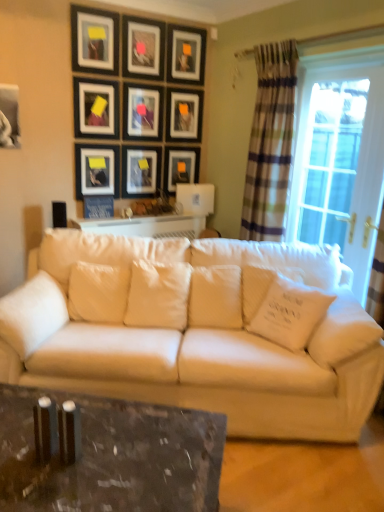
Describe the element at coordinates (196, 339) in the screenshot. The height and width of the screenshot is (512, 384). I see `white fabric couch at center` at that location.

Describe the element at coordinates (184, 115) in the screenshot. I see `matte black picture frame at upper center, the 4th picture frame from the top` at that location.

Image resolution: width=384 pixels, height=512 pixels. What do you see at coordinates (98, 292) in the screenshot? I see `white fabric pillow at center, which is the second pillow from left to right` at bounding box center [98, 292].

Image resolution: width=384 pixels, height=512 pixels. What do you see at coordinates (96, 108) in the screenshot? I see `matte black picture frame at upper center, which is counted as the 5th picture frame, starting from the bottom` at bounding box center [96, 108].

Locate an element on the screen. This screenshot has height=512, width=384. plaid fabric curtain at right is located at coordinates (270, 143).

Measure the distance between point [133,46] and camera.

10.66 feet.

Locate an element on the screen. white fabric couch at center is located at coordinates (196, 339).

Could you tell me if matte black picture frame at upper left, which is counted as the 9th picture frame, starting from the top, is turned towards white soft pillow at left, the first pillow positioned from the left?

No, matte black picture frame at upper left, which is counted as the 9th picture frame, starting from the top, does not turn towards white soft pillow at left, the first pillow positioned from the left.

Is the surface of matte black picture frame at upper left, which is counted as the 9th picture frame, starting from the top, in direct contact with white soft pillow at left, the first pillow positioned from the left?

matte black picture frame at upper left, which is counted as the 9th picture frame, starting from the top, and white soft pillow at left, the first pillow positioned from the left, are clearly separated.

Which point is more distant from viewer, (97,170) or (55,303)?

The point (97,170) is farther from the camera.

Considering the positions of objects white fabric couch at center and white soft pillow at left, which is the fifth pillow from right to left, in the image provided, who is behind, white fabric couch at center or white soft pillow at left, which is the fifth pillow from right to left,?

Positioned behind is white soft pillow at left, which is the fifth pillow from right to left.

Is white fabric couch at center wider than white soft pillow at left, which is the fifth pillow from right to left?

Correct, the width of white fabric couch at center exceeds that of white soft pillow at left, which is the fifth pillow from right to left.

Which of these two, white fabric couch at center or white soft pillow at left, the first pillow positioned from the left, is smaller?

Smaller between the two is white soft pillow at left, the first pillow positioned from the left.

Is white fabric couch at center not near white soft pillow at left, the first pillow positioned from the left?

No, white fabric couch at center is in close proximity to white soft pillow at left, the first pillow positioned from the left.

Based on their positions, is matte black picture frame at center, marked as the 6th picture frame in a bottom-to-top arrangement, located to the left or right of clear glass window at right?

Clearly, matte black picture frame at center, marked as the 6th picture frame in a bottom-to-top arrangement, is on the left of clear glass window at right in the image.

From a real-world perspective, which object rests below the other?

clear glass window at right, from a real-world perspective.

Can you see matte black picture frame at center, marked as the 6th picture frame in a bottom-to-top arrangement, touching clear glass window at right?

No, matte black picture frame at center, marked as the 6th picture frame in a bottom-to-top arrangement, is not making contact with clear glass window at right.

Is matte black picture frame at center, marked as the 6th picture frame in a bottom-to-top arrangement, looking in the opposite direction of clear glass window at right?

matte black picture frame at center, marked as the 6th picture frame in a bottom-to-top arrangement, is not turned away from clear glass window at right.

Considering the positions of point (23, 328) and point (95, 70), is point (23, 328) closer or farther from the camera than point (95, 70)?

Point (23, 328) appears to be closer to the viewer than point (95, 70).

How different are the orientations of white soft pillow at left, the first pillow positioned from the left, and matte black picture frame at upper left, the 8th picture frame from the bottom, in degrees?

white soft pillow at left, the first pillow positioned from the left, and matte black picture frame at upper left, the 8th picture frame from the bottom, are facing 53.5 degrees away from each other.

From the picture: Is white soft pillow at left, which is the fifth pillow from right to left, next to matte black picture frame at upper left, which is the third picture frame from top to bottom?

No, white soft pillow at left, which is the fifth pillow from right to left, is not making contact with matte black picture frame at upper left, which is the third picture frame from top to bottom.

From a real-world perspective, is white soft pillow at left, which is the fifth pillow from right to left, located higher than matte black picture frame at upper left, which is the third picture frame from top to bottom?

No, from a real-world perspective, white soft pillow at left, which is the fifth pillow from right to left, is not above matte black picture frame at upper left, which is the third picture frame from top to bottom.

Are white quilted pillow at center, marked as the 4th pillow in a left-to-right arrangement, and matte black picture frame at upper left, the 8th picture frame from the bottom, located far from each other?

Yes.

Is white quilted pillow at center, marked as the 4th pillow in a left-to-right arrangement, facing away from matte black picture frame at upper left, the 8th picture frame from the bottom?

white quilted pillow at center, marked as the 4th pillow in a left-to-right arrangement, does not have its back to matte black picture frame at upper left, the 8th picture frame from the bottom.

From a real-world perspective, which object stands above the other?

matte black picture frame at upper left, which is the third picture frame from top to bottom, from a real-world perspective.

Can matte black picture frame at upper left, the 8th picture frame from the bottom, be found inside white quilted pillow at center, marked as the 4th pillow in a left-to-right arrangement?

No, matte black picture frame at upper left, the 8th picture frame from the bottom, is not a part of white quilted pillow at center, marked as the 4th pillow in a left-to-right arrangement.

Considering the relative positions of matte black picture frame at upper center, the 4th picture frame from the top, and matte black picture frame at upper left, the 2th picture frame in the bottom-to-top sequence, in the image provided, is matte black picture frame at upper center, the 4th picture frame from the top, to the left or to the right of matte black picture frame at upper left, the 2th picture frame in the bottom-to-top sequence,?

Clearly, matte black picture frame at upper center, the 4th picture frame from the top, is on the right of matte black picture frame at upper left, the 2th picture frame in the bottom-to-top sequence, in the image.

From a real-world perspective, who is located higher, matte black picture frame at upper center, the 4th picture frame from the top, or matte black picture frame at upper left, which is counted as the 9th picture frame, starting from the top?

matte black picture frame at upper center, the 4th picture frame from the top, from a real-world perspective.

The image size is (384, 512). Find the location of `the 5th picture frame positioned below the matte black picture frame at upper center, the 4th picture frame from the top (from the image's perspective)`. the 5th picture frame positioned below the matte black picture frame at upper center, the 4th picture frame from the top (from the image's perspective) is located at coordinates (x=97, y=170).

Are matte black picture frame at upper center, the 4th picture frame from the top, and matte black picture frame at upper left, which is counted as the 9th picture frame, starting from the top, beside each other?

No, matte black picture frame at upper center, the 4th picture frame from the top, is not touching matte black picture frame at upper left, which is counted as the 9th picture frame, starting from the top.

Is matte black picture frame at upper left, the 8th picture frame from the bottom, oriented away from blue fabric picture frame at upper left, which appears as the first picture frame when ordered from the bottom?

No, matte black picture frame at upper left, the 8th picture frame from the bottom,'s orientation is not away from blue fabric picture frame at upper left, which appears as the first picture frame when ordered from the bottom.

Is matte black picture frame at upper left, which is the third picture frame from top to bottom, positioned beyond the bounds of blue fabric picture frame at upper left, the 10th picture frame positioned from the top?

Yes, matte black picture frame at upper left, which is the third picture frame from top to bottom, is not within blue fabric picture frame at upper left, the 10th picture frame positioned from the top.

Looking at the image, does matte black picture frame at upper left, which is the third picture frame from top to bottom, seem bigger or smaller compared to blue fabric picture frame at upper left, which appears as the first picture frame when ordered from the bottom?

Clearly, matte black picture frame at upper left, which is the third picture frame from top to bottom, is larger in size than blue fabric picture frame at upper left, which appears as the first picture frame when ordered from the bottom.

Considering the relative positions of matte black picture frame at upper left, the 8th picture frame from the bottom, and blue fabric picture frame at upper left, which appears as the first picture frame when ordered from the bottom, in the image provided, is matte black picture frame at upper left, the 8th picture frame from the bottom, to the right of blue fabric picture frame at upper left, which appears as the first picture frame when ordered from the bottom, from the viewer's perspective?

Yes.

Image resolution: width=384 pixels, height=512 pixels. I want to click on the 4th picture frame behind when counting from the white soft pillow at left, which is the fifth pillow from right to left, so click(97, 170).

Locate an element on the screen. The image size is (384, 512). studio couch that appears on the right of white soft pillow at left, the first pillow positioned from the left is located at coordinates (196, 339).

Which object lies nearer to the anchor point matte black picture frame at upper center, which is the 9th picture frame in bottom-to-top order, matte black picture frame at upper center, the sixth picture frame in the top-to-bottom sequence, or matte black picture frame at upper center, the first picture frame viewed from the top?

matte black picture frame at upper center, the first picture frame viewed from the top, lies closer to matte black picture frame at upper center, which is the 9th picture frame in bottom-to-top order, than the other object.

Consider the image. Estimate the real-world distances between objects in this image. Which object is closer to matte black picture frame at center, the fourth picture frame ordered from the bottom, matte black picture frame at center, marked as the 6th picture frame in a bottom-to-top arrangement, or white quilted pillow at center, which is the second pillow from right to left?

The object closer to matte black picture frame at center, the fourth picture frame ordered from the bottom, is matte black picture frame at center, marked as the 6th picture frame in a bottom-to-top arrangement.

Estimate the real-world distances between objects in this image. Which object is closer to white textured pillow at right, which is the 3th pillow from right to left, matte black picture frame at center, which is the seventh picture frame from top to bottom, or matte black picture frame at upper center, the second picture frame positioned from the top?

matte black picture frame at center, which is the seventh picture frame from top to bottom, lies closer to white textured pillow at right, which is the 3th pillow from right to left, than the other object.

Which object lies nearer to the anchor point blue fabric picture frame at upper left, the 10th picture frame positioned from the top, white fabric couch at center or matte black picture frame at upper center, which is the 9th picture frame in bottom-to-top order?

matte black picture frame at upper center, which is the 9th picture frame in bottom-to-top order.

Which object lies nearer to the anchor point plaid fabric curtain at right, white soft pillow at left, the first pillow positioned from the left, or white soft pillow at right, the first pillow positioned from the right?

Among the two, white soft pillow at right, the first pillow positioned from the right, is located nearer to plaid fabric curtain at right.

Estimate the real-world distances between objects in this image. Which object is closer to blue fabric picture frame at upper left, which appears as the first picture frame when ordered from the bottom, matte black picture frame at upper center, the second picture frame positioned from the top, or white quilted pillow at center, which is the second pillow from right to left?

matte black picture frame at upper center, the second picture frame positioned from the top.

When comparing their distances from matte black picture frame at upper left, which is the third picture frame from top to bottom, does white soft pillow at right, the first pillow positioned from the right, or marble glass table at center seem closer?

white soft pillow at right, the first pillow positioned from the right, is closer to matte black picture frame at upper left, which is the third picture frame from top to bottom.

Which object lies further to the anchor point matte black picture frame at center, which is the seventh picture frame from top to bottom, clear glass window at right or white fabric couch at center?

The object further to matte black picture frame at center, which is the seventh picture frame from top to bottom, is white fabric couch at center.

In order to click on pillow that lies between matte black picture frame at upper center, the 4th picture frame from the top, and white textured pillow at right, which is the 3th pillow from right to left, from top to bottom in this screenshot , I will do `click(98, 292)`.

What are the coordinates of `window between matte black picture frame at upper center, placed as the 10th picture frame when sorted from bottom to top, and white soft pillow at left, the first pillow positioned from the left, vertically` in the screenshot? It's located at (339, 155).

Locate an element on the screen. curtain between matte black picture frame at upper center, which is counted as the 5th picture frame, starting from the bottom, and white fabric couch at center from top to bottom is located at coordinates (270, 143).

This screenshot has height=512, width=384. Identify the location of window between white fabric couch at center and matte black picture frame at center, which is the seventh picture frame from top to bottom, along the z-axis. (339, 155).